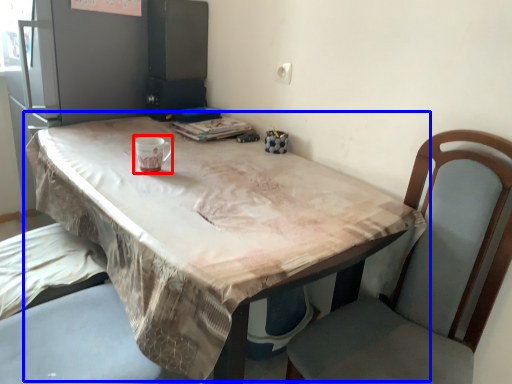
Question: Among these objects, which one is nearest to the camera, mug (highlighted by a red box) or table (highlighted by a blue box)?

Choices:
 (A) mug
 (B) table

Answer: (B)